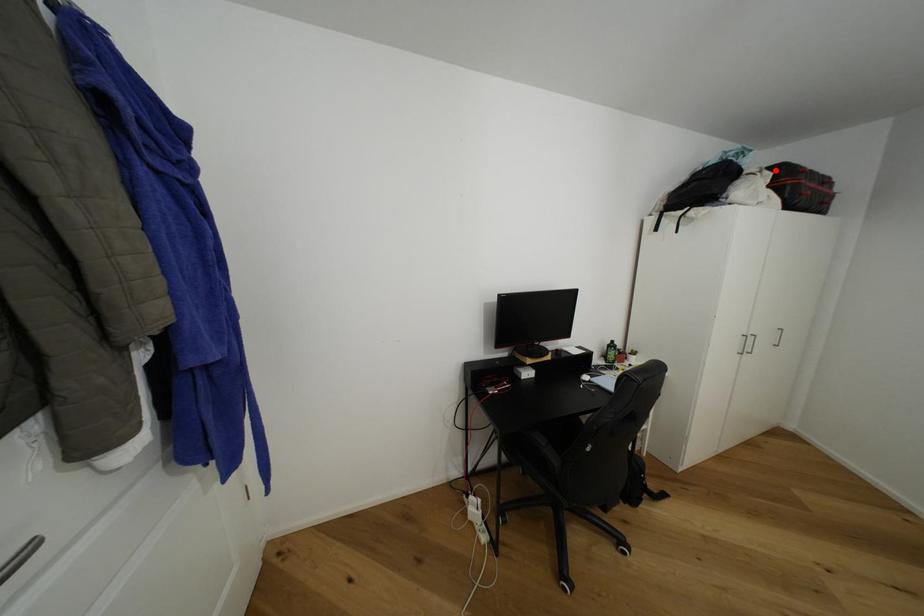
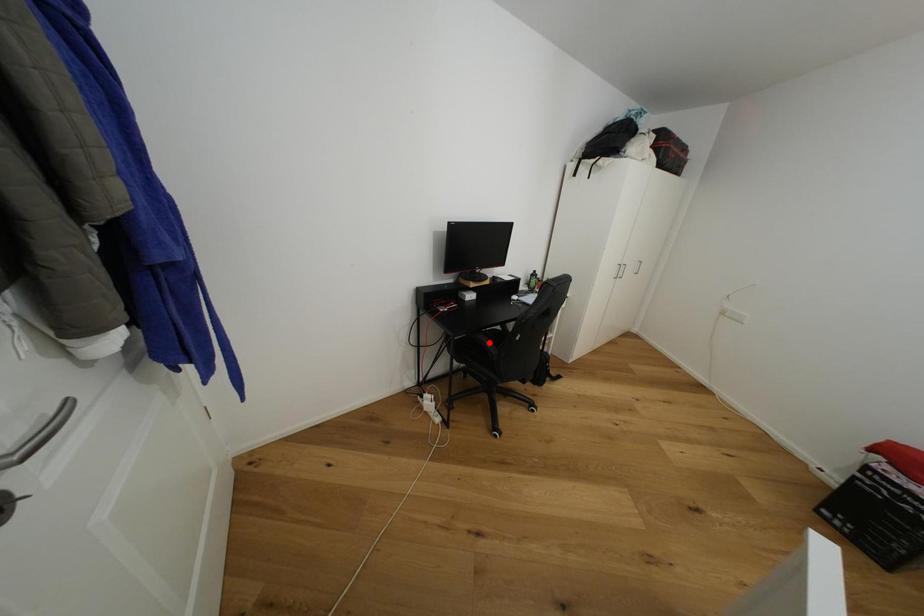
I am providing you with two images of the same scene from different viewpoints. A red point is marked on the first image and another point is marked on the second image. Is the marked point in image1 the same physical position as the marked point in image2?

No